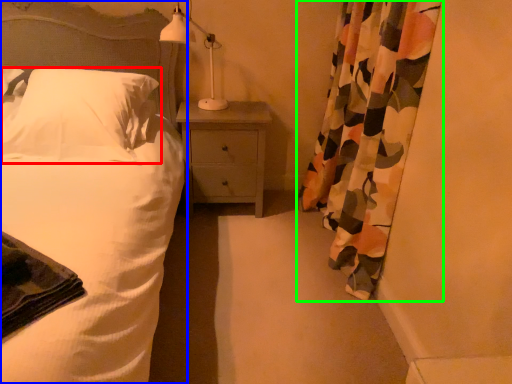
Question: Considering the real-world distances, which object is closest to pillow (highlighted by a red box)? bed (highlighted by a blue box) or curtain (highlighted by a green box).

Choices:
 (A) bed
 (B) curtain

Answer: (A)